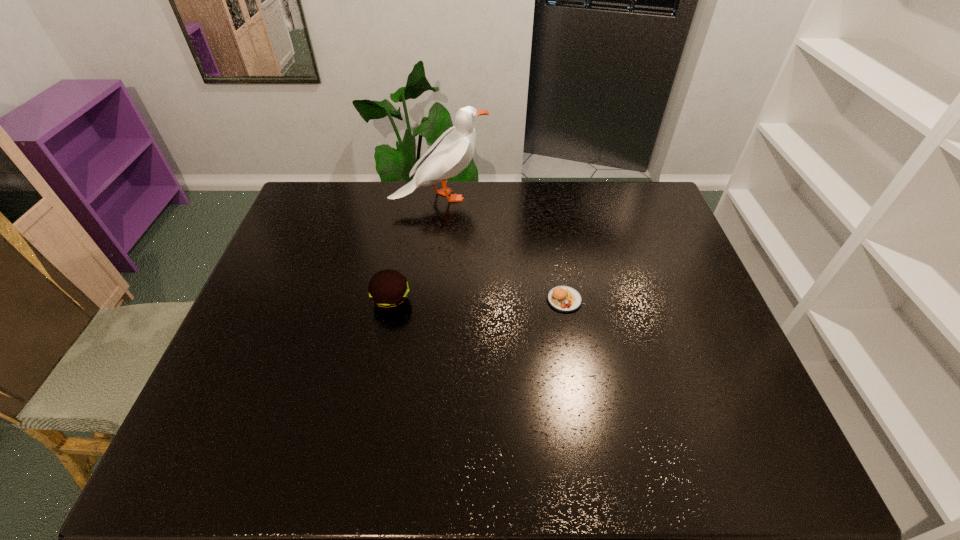
The width and height of the screenshot is (960, 540). I want to click on blank area in the image that satisfies the following two spatial constraints: 1. on the back side of the right patty; 2. on the left side of the taller patty, so click(x=392, y=300).

The height and width of the screenshot is (540, 960). Find the location of `free location that satisfies the following two spatial constraints: 1. at the beak of the right patty; 2. on the right side of the farthest object`. free location that satisfies the following two spatial constraints: 1. at the beak of the right patty; 2. on the right side of the farthest object is located at coordinates (430, 300).

Image resolution: width=960 pixels, height=540 pixels. In order to click on vacant region that satisfies the following two spatial constraints: 1. at the beak of the farthest object; 2. on the right side of the rightmost object in this screenshot , I will do `click(430, 300)`.

I want to click on free spot that satisfies the following two spatial constraints: 1. at the beak of the farthest object; 2. on the right side of the right patty, so click(x=430, y=300).

Identify the location of free space that satisfies the following two spatial constraints: 1. at the beak of the tallest object; 2. on the back side of the shortest object. (430, 300).